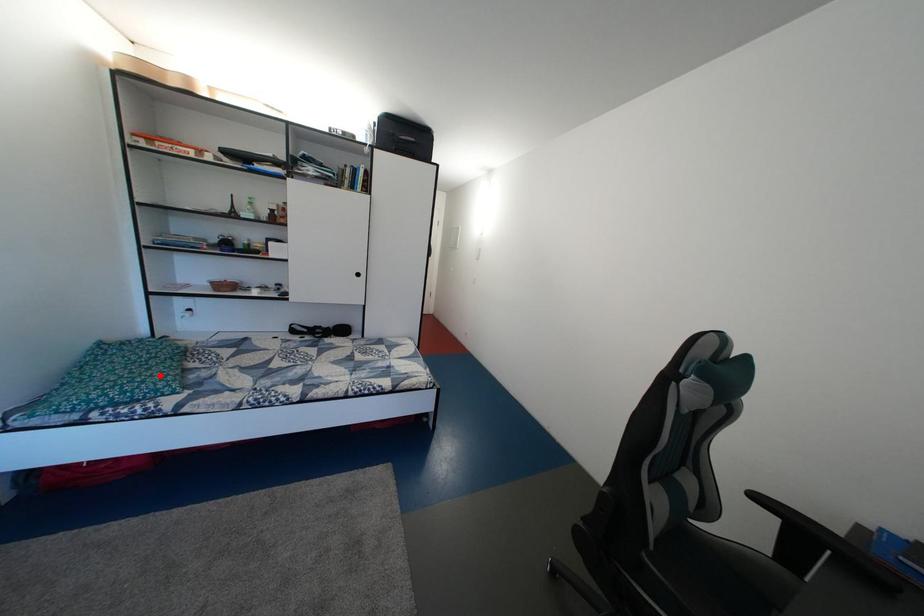
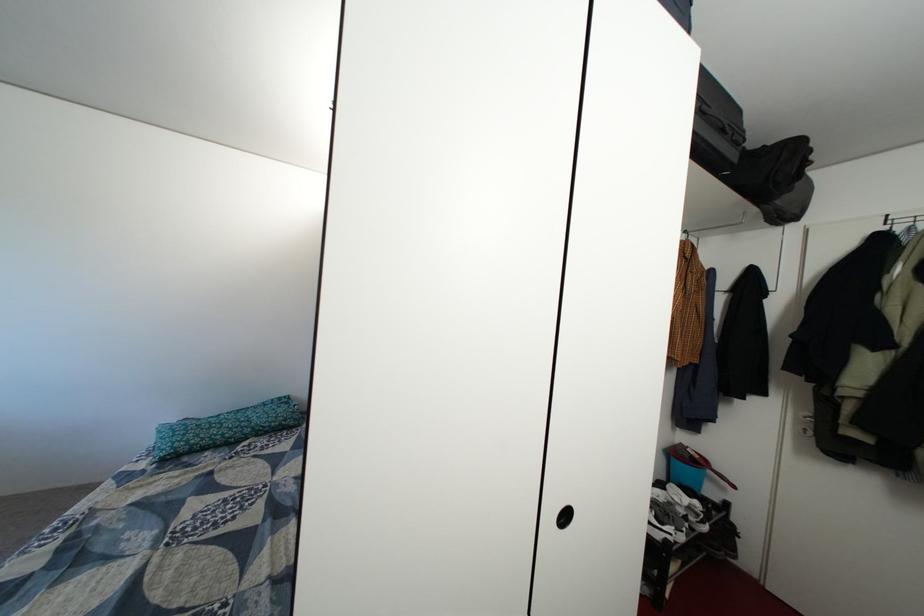
Where in the second image is the point corresponding to the highlighted location from the first image?

(222, 435)